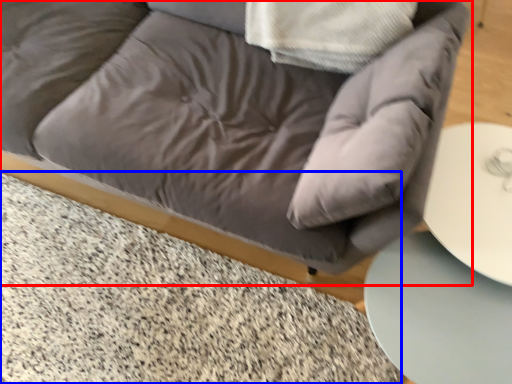
Question: Which object appears farthest to the camera in this image, studio couch (highlighted by a red box) or marble (highlighted by a blue box)?

Choices:
 (A) studio couch
 (B) marble

Answer: (B)